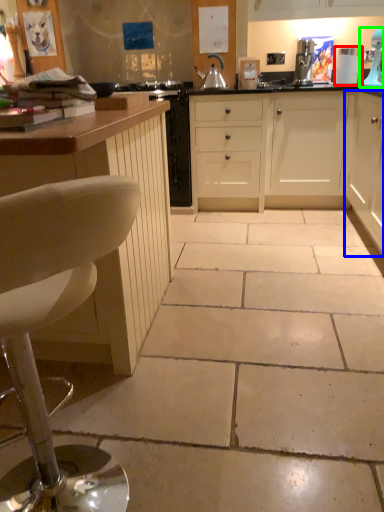
Question: Estimate the real-world distances between objects in this image. Which object is closer to appliance (highlighted by a red box), cabinetry (highlighted by a blue box) or home appliance (highlighted by a green box)?

Choices:
 (A) cabinetry
 (B) home appliance

Answer: (B)